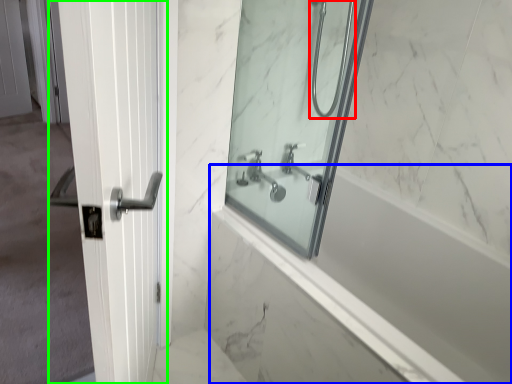
Question: Which object is the closest to the shower (highlighted by a red box)? Choose among these: bath (highlighted by a blue box) or door (highlighted by a green box).

Choices:
 (A) bath
 (B) door

Answer: (A)